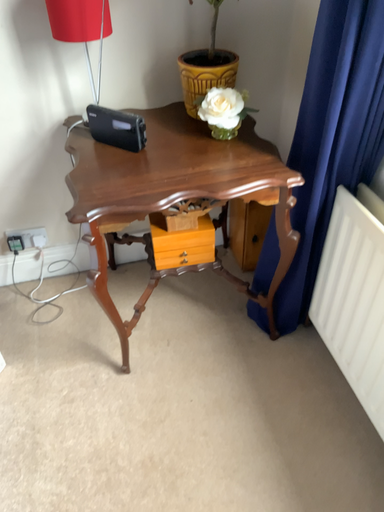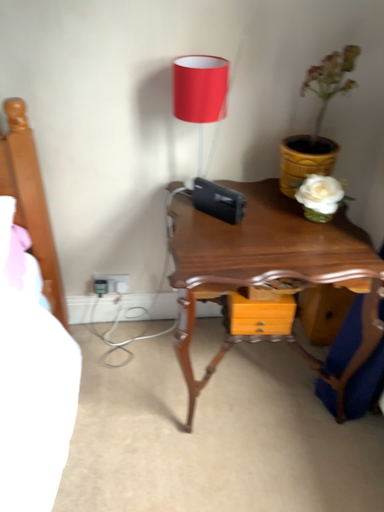
Question: How did the camera likely rotate when shooting the video?

Choices:
 (A) rotated upward
 (B) rotated downward

Answer: (A)